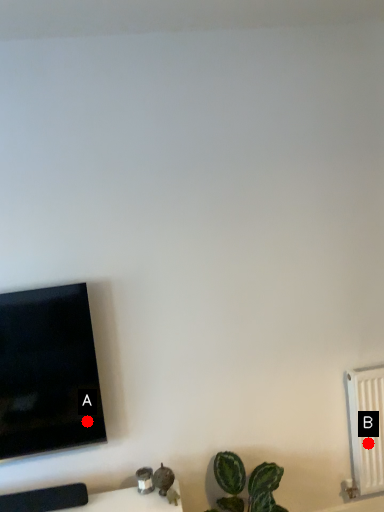
Question: Two points are circled on the image, labeled by A and B beside each circle. Which point is closer to the camera taking this photo?

Choices:
 (A) A is closer
 (B) B is closer

Answer: (A)